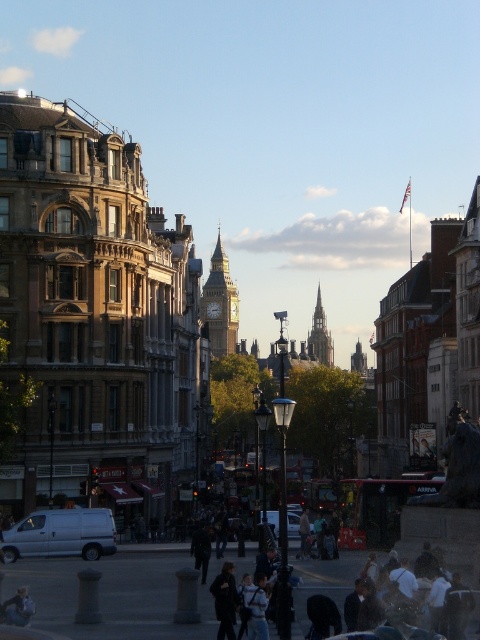
Question: Can you confirm if golden stone clock tower at center is positioned to the right of metallic silver van at center?

Choices:
 (A) yes
 (B) no

Answer: (B)

Question: Which point is closer to the camera taking this photo?

Choices:
 (A) (225, 292)
 (B) (229, 596)

Answer: (B)

Question: Is white matte van at lower left above white cotton shirt at lower right?

Choices:
 (A) yes
 (B) no

Answer: (B)

Question: Among these points, which one is farthest from the camera?

Choices:
 (A) (312, 353)
 (B) (272, 518)
 (C) (231, 310)
 (D) (236, 600)

Answer: (A)

Question: In this image, where is white matte van at lower left located relative to metallic silver van at center?

Choices:
 (A) below
 (B) above

Answer: (B)

Question: Among these points, which one is nearest to the camera?

Choices:
 (A) (226, 564)
 (B) (38, 524)

Answer: (A)